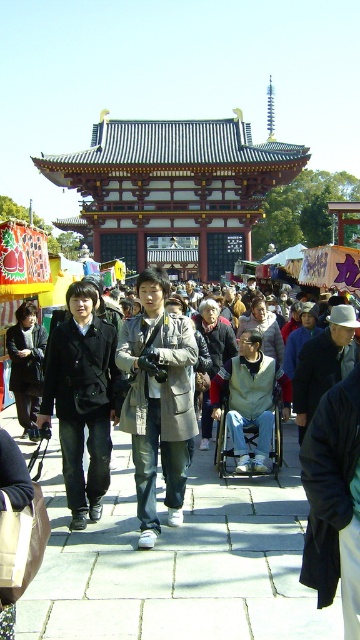
In the scene shown: You are a tour guide leading a group to the shiny dark brown wooden gate at center. A tourist asks if they can quickly walk from their current position at the black fabric coat at center to the gate before the temple tour starts in 2 minutes. Assuming a normal walking speed of 1.4 m per second, can they make it?

The distance between the shiny dark brown wooden gate at center and the black fabric coat at center is 49.95 meters. At a walking speed of 1.4 m per second, it would take approximately 35.68 seconds to cover the distance. Since the tour starts in 2 minutes, which is 120 seconds, they have enough time to reach the gate before the tour begins.